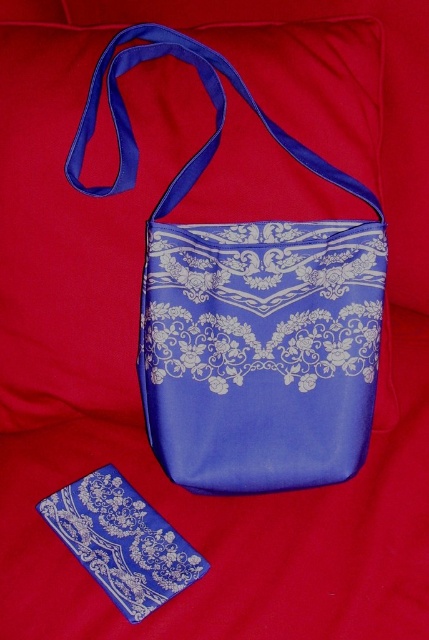
Between point (226, 419) and point (81, 163), which one is positioned in front?

Positioned in front is point (226, 419).

How far apart are blue satin/velvet shoulder bag at center and blue satin strap at upper center?

13.19 centimeters

Who is more forward, (x=123, y=100) or (x=366, y=204)?

Positioned in front is point (x=123, y=100).

Image resolution: width=429 pixels, height=640 pixels. Find the location of `blue satin/velvet shoulder bag at center`. blue satin/velvet shoulder bag at center is located at coordinates (245, 308).

Between point (148, 541) and point (205, 154), which one is positioned behind?

The point (205, 154) is more distant.

Is point (65, 529) positioned behind point (271, 132)?

No, it is in front of (271, 132).

What do you see at coordinates (121, 541) in the screenshot?
I see `blue satin wallet at center` at bounding box center [121, 541].

You are a GUI agent. You are given a task and a screenshot of the screen. Output one action in this format:
    pyautogui.click(x=<x>, y=<y>)
    Task: Click on the blue satin wallet at center
    Image resolution: width=429 pixels, height=640 pixels.
    Given the screenshot: What is the action you would take?
    pos(121,541)

Which is above, blue satin/velvet shoulder bag at center or blue satin wallet at center?

blue satin/velvet shoulder bag at center

Between blue satin/velvet shoulder bag at center and blue satin wallet at center, which one appears on the right side from the viewer's perspective?

blue satin/velvet shoulder bag at center

Between point (352, 412) and point (193, 573), which one is positioned in front?

Point (193, 573)

This screenshot has height=640, width=429. Find the location of `blue satin/velvet shoulder bag at center`. blue satin/velvet shoulder bag at center is located at coordinates (245, 308).